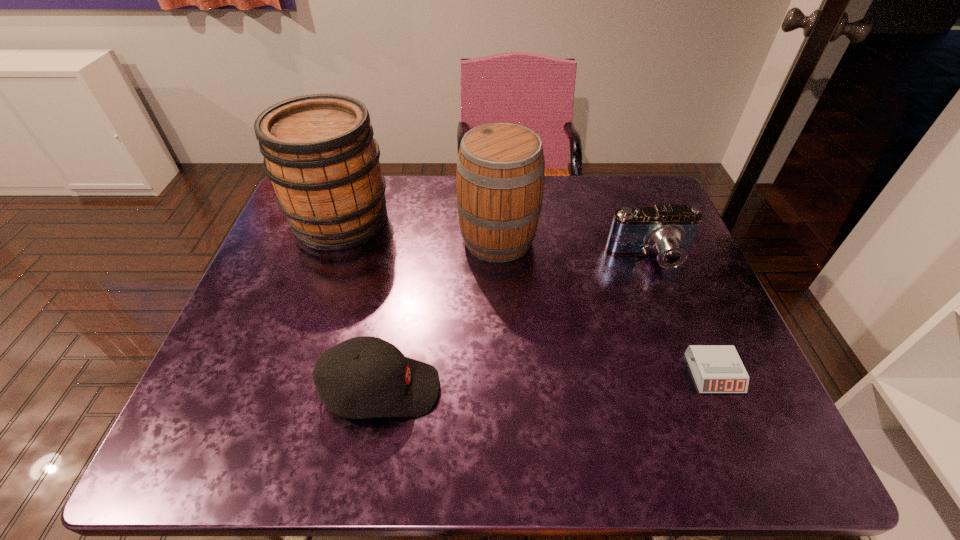
You are a GUI agent. You are given a task and a screenshot of the screen. Output one action in this format:
    pyautogui.click(x=<x>, y=<y>)
    Task: Click on the object that can be found as the third closest to the baseball cap
    The height and width of the screenshot is (540, 960).
    Given the screenshot: What is the action you would take?
    pyautogui.click(x=668, y=231)

The image size is (960, 540). Find the location of `object identified as the third closest to the left cider`. object identified as the third closest to the left cider is located at coordinates click(668, 231).

The height and width of the screenshot is (540, 960). Find the location of `free point that satisfies the following two spatial constraints: 1. on the front-facing side of the alarm clock; 2. on the left side of the camcorder`. free point that satisfies the following two spatial constraints: 1. on the front-facing side of the alarm clock; 2. on the left side of the camcorder is located at coordinates (x=695, y=373).

Locate an element on the screen. free region that satisfies the following two spatial constraints: 1. on the front side of the left cider; 2. on the right side of the shortest object is located at coordinates (288, 373).

The image size is (960, 540). Find the location of `free location that satisfies the following two spatial constraints: 1. on the front-facing side of the camcorder; 2. with a logo on the front of the baseball cap`. free location that satisfies the following two spatial constraints: 1. on the front-facing side of the camcorder; 2. with a logo on the front of the baseball cap is located at coordinates (701, 389).

Find the location of a particular element. vacant space that satisfies the following two spatial constraints: 1. on the front side of the shortest object; 2. on the left side of the left cider is located at coordinates (288, 373).